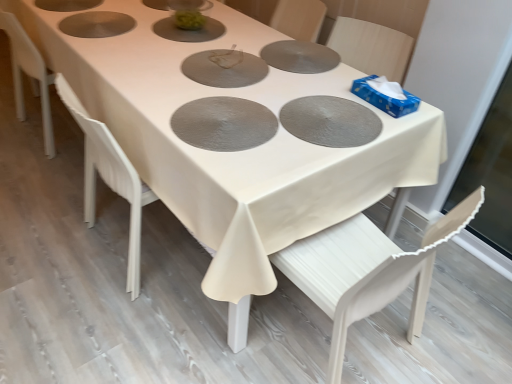
Locate an element on the screen. This screenshot has width=512, height=384. vacant area that lies between textured silver pizza pan at center, which is counted as the third pizza pan, starting from the top, and matte gray pizza pan at center, which ranks as the third pizza pan in bottom-to-top order is located at coordinates pos(211,85).